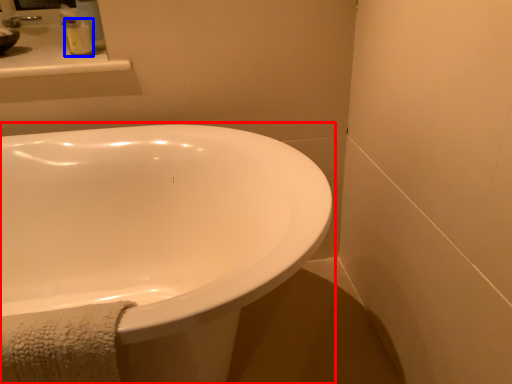
Question: Among these objects, which one is nearest to the camera, bathtub (highlighted by a red box) or soap dispenser (highlighted by a blue box)?

Choices:
 (A) bathtub
 (B) soap dispenser

Answer: (A)